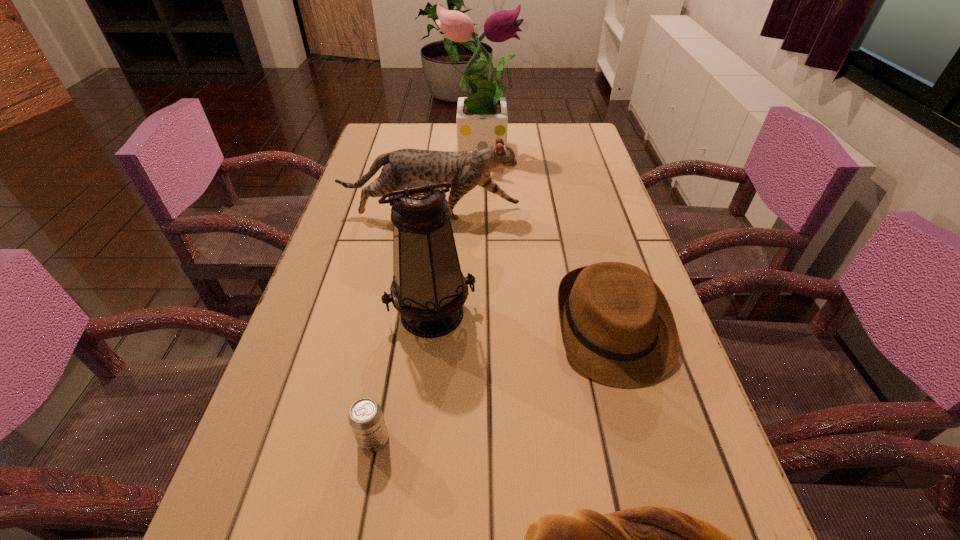
Find the location of a particular element. Image resolution: width=960 pixels, height=540 pixels. free spot located on the front-facing side of the fedora is located at coordinates (655, 482).

I want to click on vacant space located 0.080m on the front of the second nearest object, so pos(361,509).

Where is `object at the far edge`? The image size is (960, 540). object at the far edge is located at coordinates (482, 117).

At what (x,y) coordinates should I click in order to perform the action: click on object positioned at the left edge. Please return your answer as a coordinate pair (x, y). Looking at the image, I should click on (465, 170).

At what (x,y) coordinates should I click in order to perform the action: click on object that is at the right edge. Please return your answer as a coordinate pair (x, y). The image size is (960, 540). Looking at the image, I should click on (617, 327).

In the image, there is a desktop. At what (x,y) coordinates should I click in order to perform the action: click on free space at the far edge. Please return your answer as a coordinate pair (x, y). This screenshot has height=540, width=960. Looking at the image, I should click on (417, 143).

Identify the location of vacant region at the left edge of the desktop. (357, 222).

Image resolution: width=960 pixels, height=540 pixels. What are the coordinates of `vacant area at the right edge` in the screenshot? It's located at (704, 474).

Locate an element on the screen. vacant region at the far right corner of the desktop is located at coordinates tap(575, 140).

Identify the location of empty location between the oil lamp and the fedora. The width and height of the screenshot is (960, 540). (522, 321).